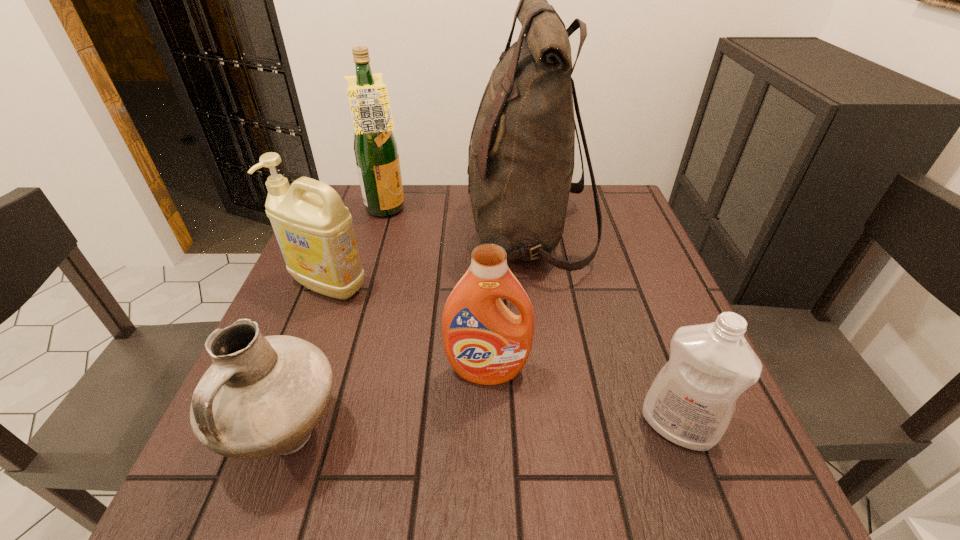
Where is `backpack`? The height and width of the screenshot is (540, 960). backpack is located at coordinates (521, 154).

Locate an element on the screen. This screenshot has width=960, height=540. the second tallest object is located at coordinates (375, 147).

I want to click on the farthest detergent, so click(x=314, y=230).

In order to click on the second farthest detergent in this screenshot , I will do `click(485, 343)`.

Find the location of a particular element. the third nearest object is located at coordinates (485, 343).

Image resolution: width=960 pixels, height=540 pixels. I want to click on the shortest detergent, so click(x=691, y=402).

This screenshot has width=960, height=540. I want to click on the nearest detergent, so click(x=691, y=402).

Find the location of `pitcher`. pitcher is located at coordinates (262, 396).

The image size is (960, 540). In order to click on vacant space located on the open flap of the tallest object in this screenshot , I will do `click(334, 233)`.

At what (x,y) coordinates should I click in order to perform the action: click on blank area located on the open flap of the tallest object. Please return your answer as a coordinate pair (x, y). Looking at the image, I should click on (388, 233).